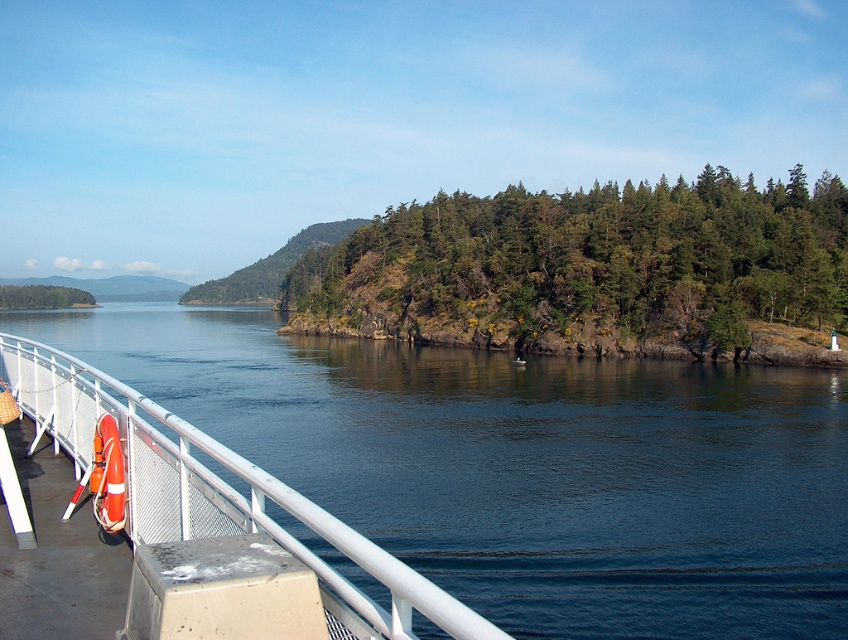
You are standing on the ferry deck and want to take a photo of the green rough textured trees at center. Where should you position yourself relative to the white metal railing with a lifebuoy attached to it to capture the trees in the center of your camera view?

To capture the green rough textured trees at center in the center of your camera view, position yourself at point (595, 272) relative to the white metal railing with a lifebuoy attached to it.

You are standing on the ferry deck and want to grab the orange rubber life jacket at lower left. However, there is a green matte tree at left blocking your path. Can you reach the life jacket without moving around the tree?

The orange rubber life jacket at lower left is closer to the viewer than the green matte tree at left, so you can reach it without moving around the tree because it is in front of the tree.